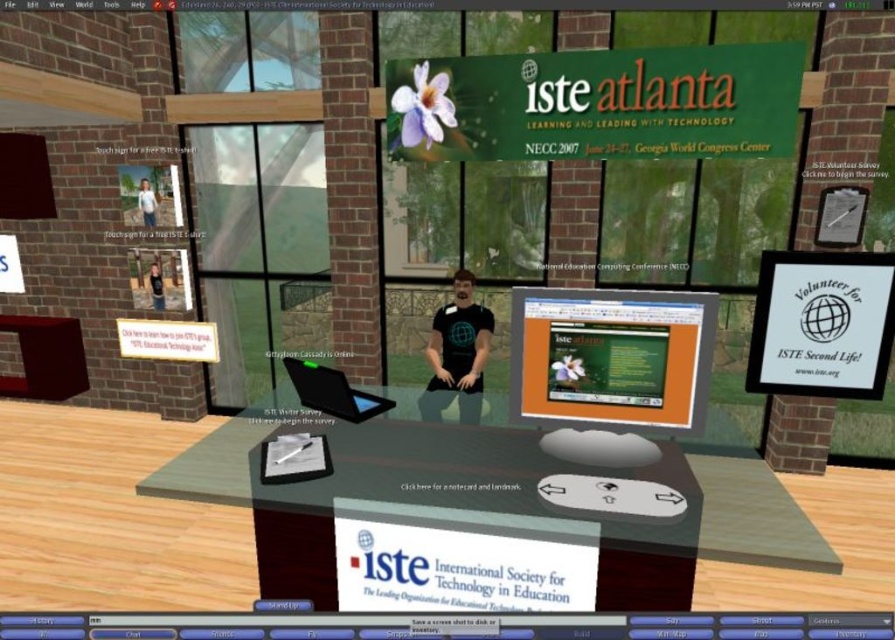
Is matte orange monitor at center above matte black t-shirt at center?

Correct, matte orange monitor at center is located above matte black t-shirt at center.

Which is behind, point (604, 337) or point (454, 324)?

Point (454, 324)

At what (x,y) coordinates should I click in order to perform the action: click on matte orange monitor at center. Please return your answer as a coordinate pair (x, y). Looking at the image, I should click on (611, 358).

Is point (473, 394) farther from camera compared to point (137, 195)?

That is False.

Which is below, matte black t-shirt at center or light blue shirt at left?

matte black t-shirt at center is below.

Between point (433, 385) and point (154, 202), which one is positioned in front?

Positioned in front is point (433, 385).

The width and height of the screenshot is (895, 640). Find the location of `matte black t-shirt at center`. matte black t-shirt at center is located at coordinates (457, 353).

Does matte orange monitor at center have a lesser height compared to shiny black laptop at center?

No.

Is matte orange monitor at center to the right of shiny black laptop at center from the viewer's perspective?

Correct, you'll find matte orange monitor at center to the right of shiny black laptop at center.

Is point (584, 369) farther from viewer compared to point (360, 392)?

No, (584, 369) is closer to viewer.

Where is `matte orange monitor at center`? The width and height of the screenshot is (895, 640). matte orange monitor at center is located at coordinates (611, 358).